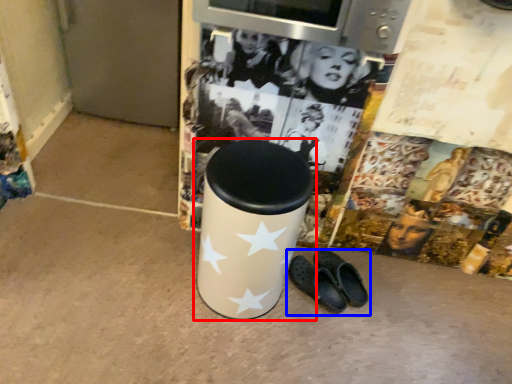
Question: Which object appears farthest to the camera in this image, waste container (highlighted by a red box) or footwear (highlighted by a blue box)?

Choices:
 (A) waste container
 (B) footwear

Answer: (B)